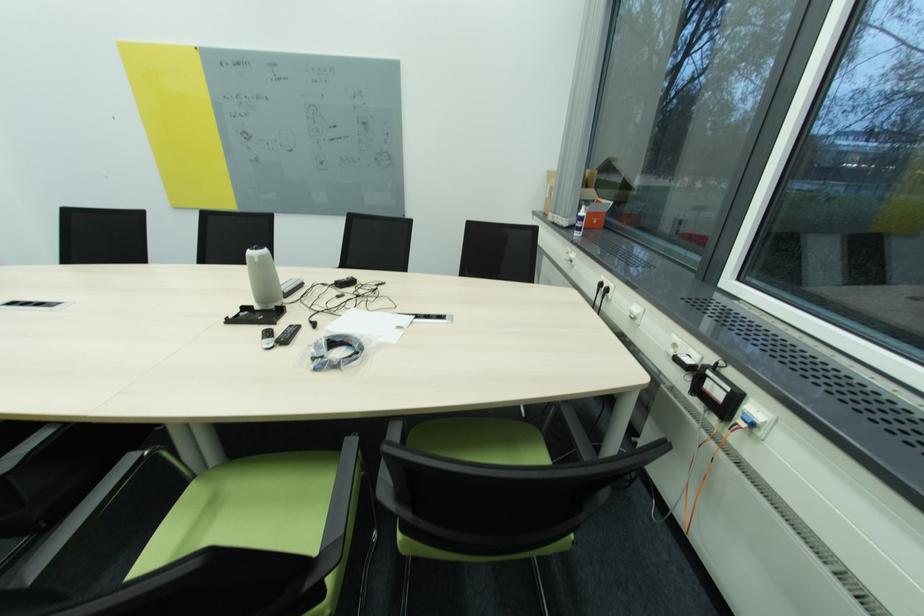
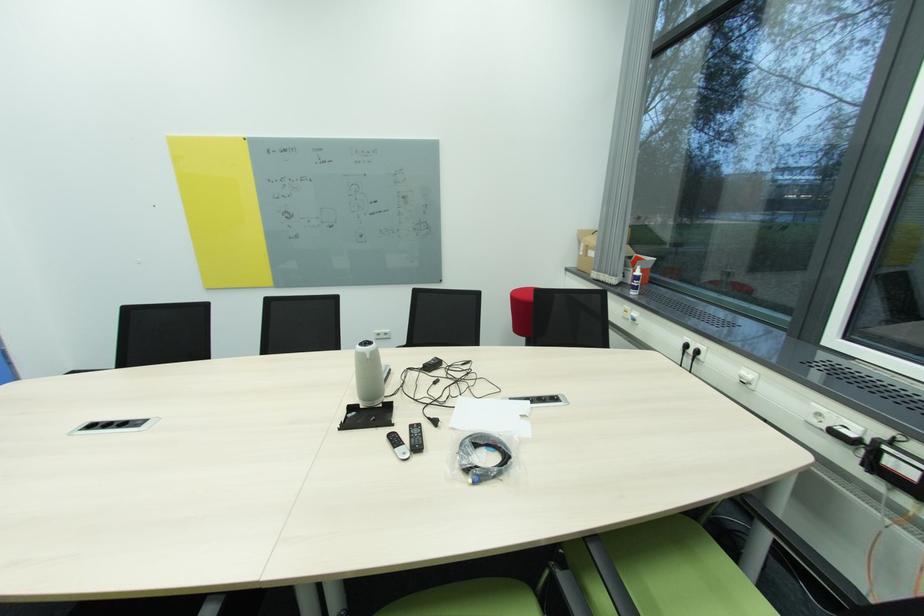
In the second image, find the point that corresponds to (x=261, y=262) in the first image.

(372, 358)